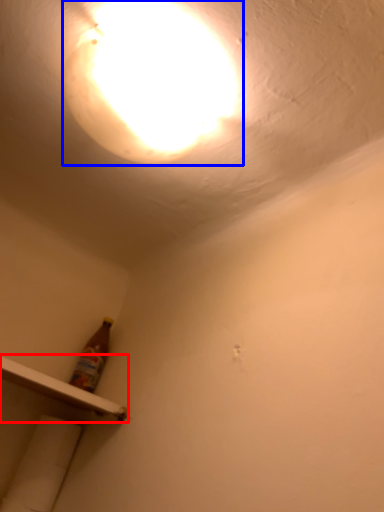
Question: Which object is further to the camera taking this photo, shelf (highlighted by a red box) or lamp (highlighted by a blue box)?

Choices:
 (A) shelf
 (B) lamp

Answer: (A)